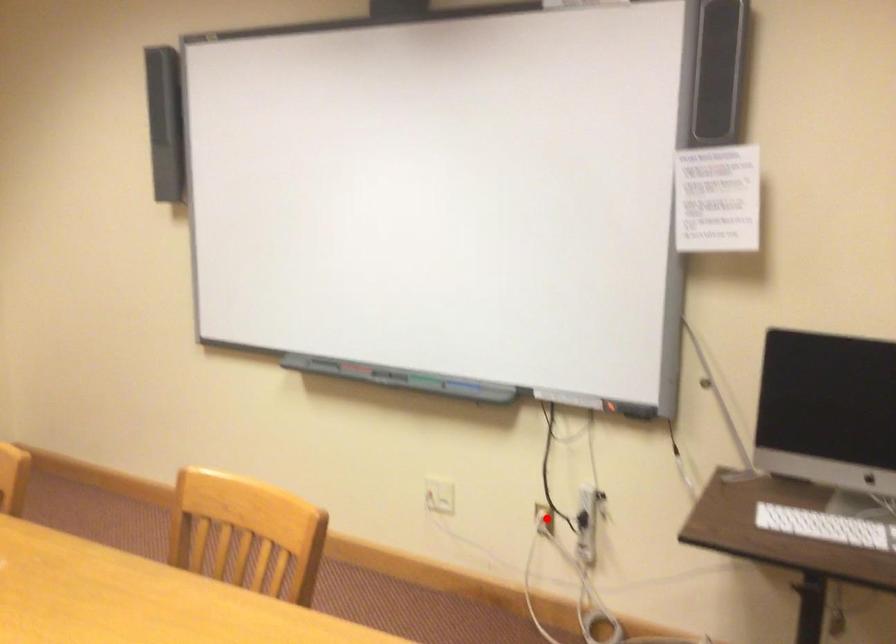
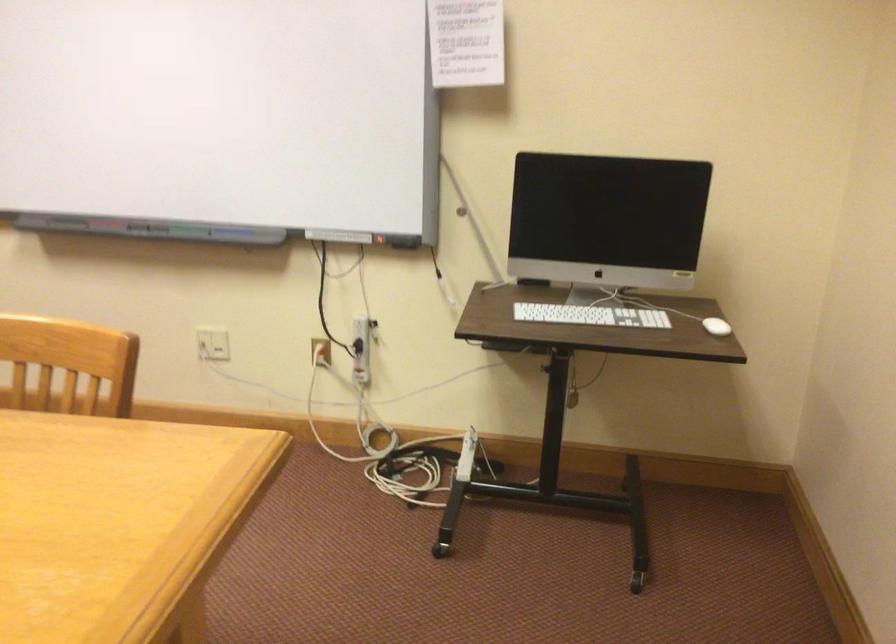
Find the pixel in the second image that matches the highlighted location in the first image.

(321, 351)